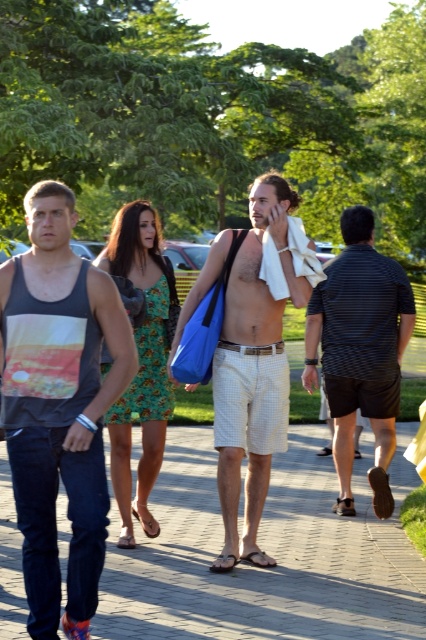
Question: Is beige checkered shorts at center to the left of striped cotton shirt at right from the viewer's perspective?

Choices:
 (A) no
 (B) yes

Answer: (B)

Question: Which point is closer to the camera?

Choices:
 (A) striped cotton shirt at right
 (B) dark gray tank top at left

Answer: (B)

Question: Estimate the real-world distances between objects in this image. Which object is closer to the beige checkered shorts at center?

Choices:
 (A) striped cotton shirt at right
 (B) green floral dress at center
 (C) brick pavement at center
 (D) dark gray tank top at left

Answer: (B)

Question: Is striped cotton shirt at right smaller than green floral dress at center?

Choices:
 (A) yes
 (B) no

Answer: (B)

Question: Estimate the real-world distances between objects in this image. Which object is farther from the striped cotton shirt at right?

Choices:
 (A) dark gray tank top at left
 (B) green floral dress at center

Answer: (A)

Question: Observing the image, what is the correct spatial positioning of brick pavement at center in reference to dark gray tank top at left?

Choices:
 (A) left
 (B) right

Answer: (B)